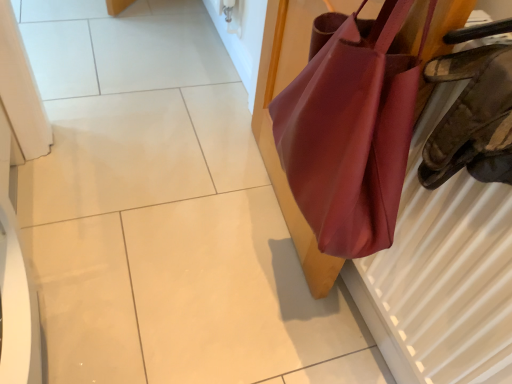
Question: Is matte leather handbag at right wider or thinner than matte brown radiator at right?

Choices:
 (A) thin
 (B) wide

Answer: (B)

Question: From a real-world perspective, is matte leather handbag at right above or below matte brown radiator at right?

Choices:
 (A) below
 (B) above

Answer: (A)

Question: Considering the relative positions of matte leather handbag at right and matte brown radiator at right in the image provided, is matte leather handbag at right to the left or to the right of matte brown radiator at right?

Choices:
 (A) right
 (B) left

Answer: (B)

Question: Based on their sizes in the image, would you say matte brown radiator at right is bigger or smaller than matte leather handbag at right?

Choices:
 (A) big
 (B) small

Answer: (B)

Question: From a real-world perspective, is matte brown radiator at right physically located above or below matte leather handbag at right?

Choices:
 (A) above
 (B) below

Answer: (A)

Question: In terms of height, does matte brown radiator at right look taller or shorter compared to matte leather handbag at right?

Choices:
 (A) tall
 (B) short

Answer: (B)

Question: From the image's perspective, relative to matte leather handbag at right, is matte brown radiator at right above or below?

Choices:
 (A) above
 (B) below

Answer: (B)